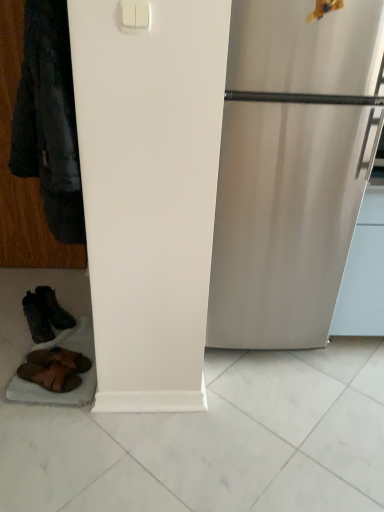
Question: Is brown leather sandals at lower left, which ranks as the third footwear in back-to-front order, closer to the viewer compared to dark brown leather boots at lower left, the 3th footwear from the front?

Choices:
 (A) yes
 (B) no

Answer: (A)

Question: Is brown leather sandals at lower left, which ranks as the third footwear in back-to-front order, shorter than dark brown leather boots at lower left, the 3th footwear from the front?

Choices:
 (A) no
 (B) yes

Answer: (B)

Question: Is brown leather sandals at lower left, which ranks as the third footwear in back-to-front order, not close to dark brown leather boots at lower left, the 1th footwear viewed from the back?

Choices:
 (A) no
 (B) yes

Answer: (A)

Question: Does brown leather sandals at lower left, which ranks as the third footwear in back-to-front order, touch dark brown leather boots at lower left, the 3th footwear from the front?

Choices:
 (A) no
 (B) yes

Answer: (A)

Question: Is brown leather sandals at lower left, which ranks as the third footwear in back-to-front order, oriented away from dark brown leather boots at lower left, the 3th footwear from the front?

Choices:
 (A) no
 (B) yes

Answer: (A)

Question: Considering the positions of brown leather sandals at lower left, the second footwear from the front, and white plastic light switch at upper center in the image, is brown leather sandals at lower left, the second footwear from the front, bigger or smaller than white plastic light switch at upper center?

Choices:
 (A) big
 (B) small

Answer: (A)

Question: In the image, is brown leather sandals at lower left, the second footwear from the front, positioned in front of or behind white plastic light switch at upper center?

Choices:
 (A) behind
 (B) front

Answer: (A)

Question: Is point (71, 355) closer or farther from the camera than point (140, 13)?

Choices:
 (A) farther
 (B) closer

Answer: (A)

Question: From a real-world perspective, is brown leather sandals at lower left, which ranks as the second footwear in back-to-front order, above or below white plastic light switch at upper center?

Choices:
 (A) above
 (B) below

Answer: (B)

Question: Looking at their shapes, would you say white plastic light switch at upper center is wider or thinner than brown leather sandals at lower left, placed as the first footwear when sorted from front to back?

Choices:
 (A) wide
 (B) thin

Answer: (B)

Question: Considering the positions of white plastic light switch at upper center and brown leather sandals at lower left, which ranks as the third footwear in back-to-front order, in the image, is white plastic light switch at upper center taller or shorter than brown leather sandals at lower left, which ranks as the third footwear in back-to-front order,?

Choices:
 (A) short
 (B) tall

Answer: (A)

Question: From a real-world perspective, is white plastic light switch at upper center above or below brown leather sandals at lower left, placed as the first footwear when sorted from front to back?

Choices:
 (A) below
 (B) above

Answer: (B)

Question: Based on their sizes in the image, would you say white plastic light switch at upper center is bigger or smaller than brown leather sandals at lower left, placed as the first footwear when sorted from front to back?

Choices:
 (A) small
 (B) big

Answer: (A)

Question: From the image's perspective, is white plastic light switch at upper center above or below dark brown leather boots at lower left, the 1th footwear viewed from the back?

Choices:
 (A) above
 (B) below

Answer: (A)

Question: Is white plastic light switch at upper center situated inside dark brown leather boots at lower left, the 1th footwear viewed from the back, or outside?

Choices:
 (A) inside
 (B) outside

Answer: (B)